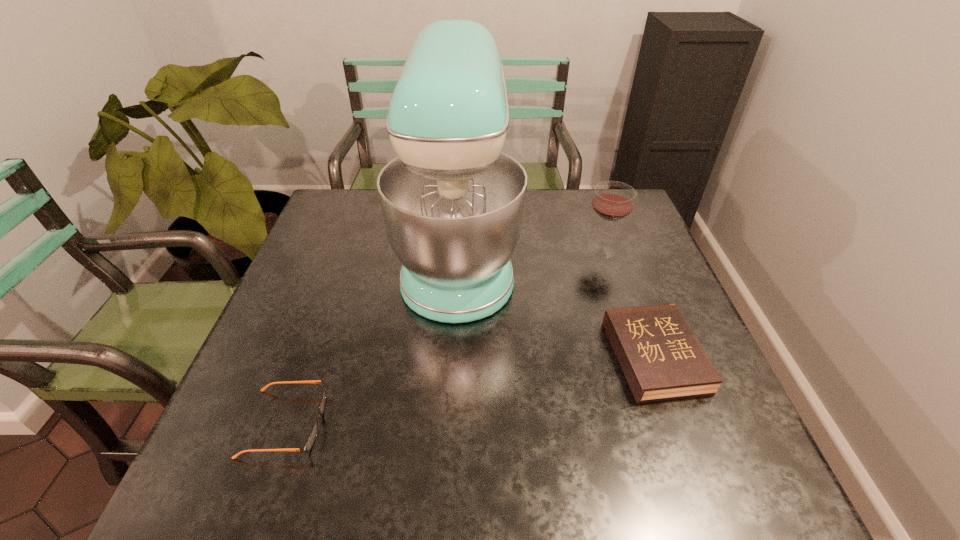
Find the location of a particular element. The width and height of the screenshot is (960, 540). object present at the far edge is located at coordinates (453, 205).

Locate an element on the screen. object that is at the near edge is located at coordinates (311, 438).

Identify the location of object that is positioned at the left edge. (311, 438).

Identify the location of wineglass located in the right edge section of the desktop. Image resolution: width=960 pixels, height=540 pixels. (612, 201).

You are a GUI agent. You are given a task and a screenshot of the screen. Output one action in this format:
    pyautogui.click(x=<x>, y=<y>)
    Task: Click on the hardback book that is at the right edge
    The width and height of the screenshot is (960, 540).
    Given the screenshot: What is the action you would take?
    pyautogui.click(x=661, y=358)

Find the location of a particular element. The image size is (960, 540). object positioned at the near left corner is located at coordinates (311, 438).

In the image, there is a desktop. Identify the location of vacant space at the far edge. Image resolution: width=960 pixels, height=540 pixels. (573, 218).

Where is `vacant space at the near edge`? Image resolution: width=960 pixels, height=540 pixels. vacant space at the near edge is located at coordinates (383, 484).

Locate an element on the screen. The height and width of the screenshot is (540, 960). free region at the left edge is located at coordinates (252, 354).

Where is `free location at the right edge`? This screenshot has height=540, width=960. free location at the right edge is located at coordinates (676, 423).